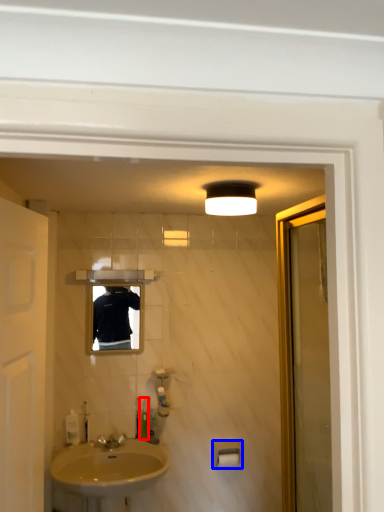
Question: Among these objects, which one is farthest to the camera, toiletry (highlighted by a red box) or towel bar (highlighted by a blue box)?

Choices:
 (A) toiletry
 (B) towel bar

Answer: (A)